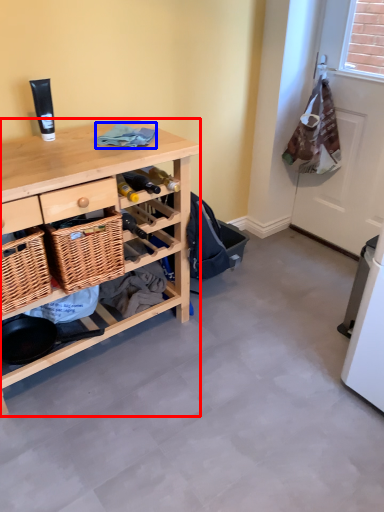
Question: Which object is further to the camera taking this photo, desk (highlighted by a red box) or clothing (highlighted by a blue box)?

Choices:
 (A) desk
 (B) clothing

Answer: (B)